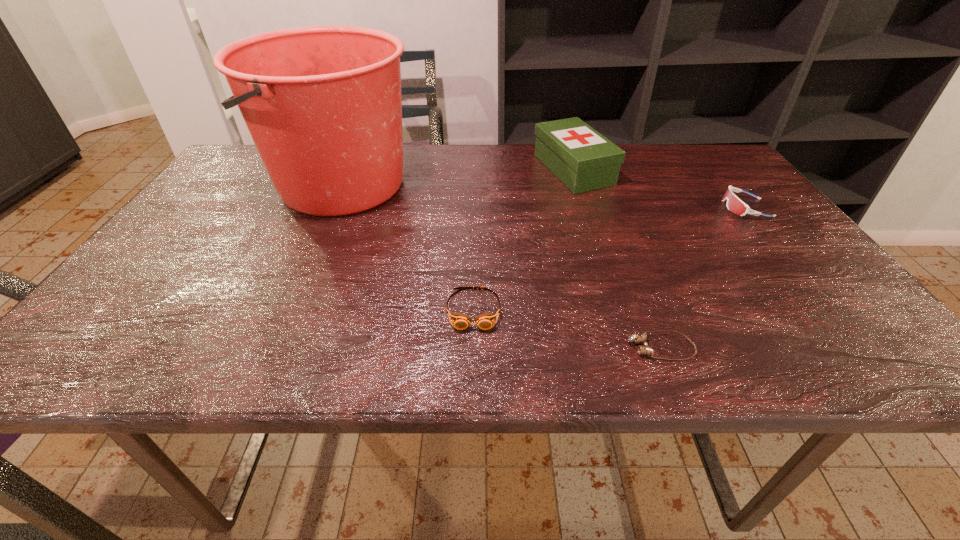
You are a GUI agent. You are given a task and a screenshot of the screen. Output one action in this format:
    pyautogui.click(x=<x>, y=<y>)
    Task: Click on the free location located on the front of the first-aid kit
    The width and height of the screenshot is (960, 540).
    Given the screenshot: What is the action you would take?
    pyautogui.click(x=588, y=215)

This screenshot has width=960, height=540. Identify the location of vacant space located on the front-facing side of the tallest goggles. (576, 208).

This screenshot has height=540, width=960. I want to click on vacant space located 0.200m on the front-facing side of the tallest goggles, so click(x=643, y=208).

Where is `free space located on the front-facing side of the tallest goggles`? The image size is (960, 540). free space located on the front-facing side of the tallest goggles is located at coordinates (703, 208).

The height and width of the screenshot is (540, 960). In order to click on vacant space located on the front lenses and sides of the shortest goggles in this screenshot , I will do pos(521,348).

You are a GUI agent. You are given a task and a screenshot of the screen. Output one action in this format:
    pyautogui.click(x=<x>, y=<y>)
    Task: Click on the vacant space located on the front lenses and sides of the shortest goggles
    
    Given the screenshot: What is the action you would take?
    pyautogui.click(x=572, y=348)

Locate an element on the screen. Image resolution: width=960 pixels, height=540 pixels. vacant space positioned 0.130m on the front lenses and sides of the shortest goggles is located at coordinates (555, 348).

Identify the location of bucket present at the far edge. The image size is (960, 540). (323, 105).

Find the location of a particular element. the first-aid kit that is at the far edge is located at coordinates (581, 158).

Image resolution: width=960 pixels, height=540 pixels. Find the location of `object that is at the left edge`. object that is at the left edge is located at coordinates (323, 105).